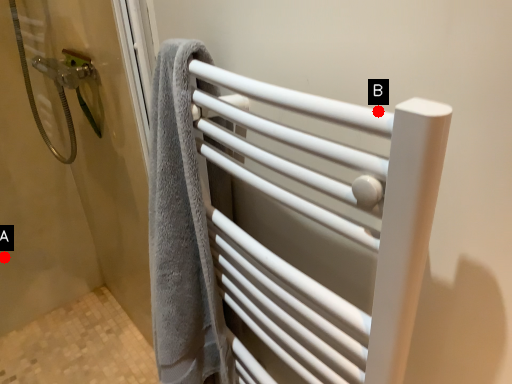
Question: Two points are circled on the image, labeled by A and B beside each circle. Which point appears closest to the camera in this image?

Choices:
 (A) A is closer
 (B) B is closer

Answer: (B)